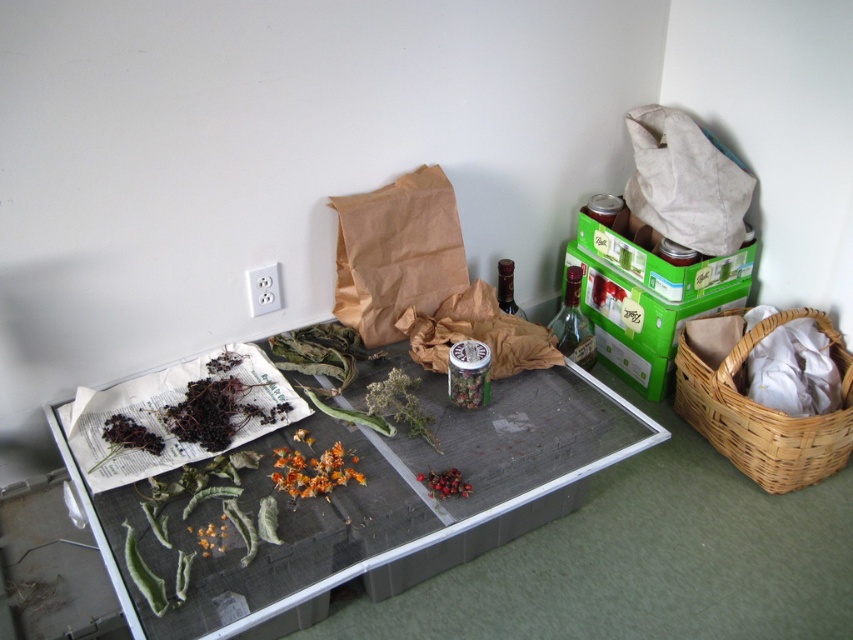
You are organizing the dried plants and need to place the woven brown basket at right and the bright red berries at center into a box that is 30 inches wide. Can both items fit side by side in the box without overlapping?

The distance between the woven brown basket at right and the bright red berries at center is 31.74 inches. Since the box is only 30 inches wide, they cannot fit side by side without overlapping.

You are organizing items in the room and need to place a new item between the woven brown basket at right and the orange matte flower at center. Based on their positions, which item should you place closer to you?

You should place the new item closer to the woven brown basket at right because it is closer to you than the orange matte flower at center.

You are organizing the items in the room and need to place a new item between the green mesh tray at center and the woven brown basket at right. Based on their positions, where should you place the new item?

The new item should be placed to the right of the green mesh tray at center and to the left of the woven brown basket at right since the green mesh tray at center is to the left of the woven brown basket at right.